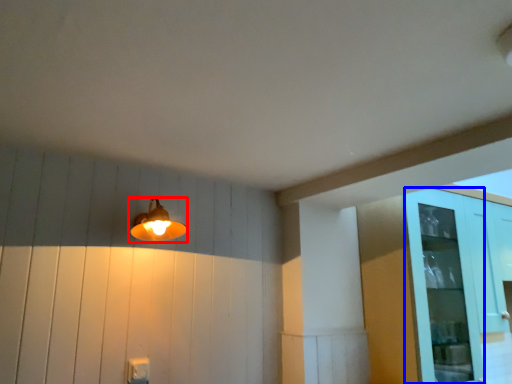
Question: Which object appears farthest to the camera in this image, lamp (highlighted by a red box) or glass door (highlighted by a blue box)?

Choices:
 (A) lamp
 (B) glass door

Answer: (B)